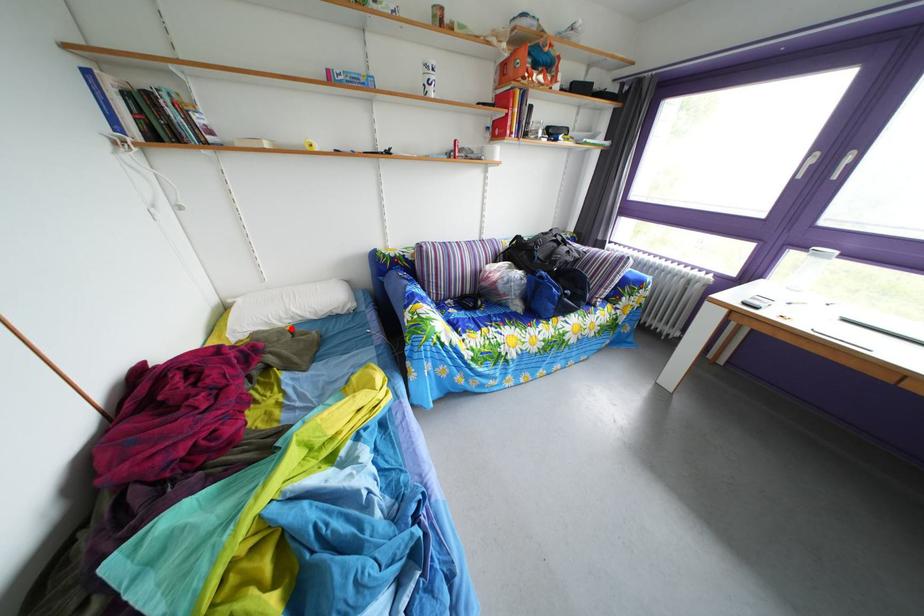
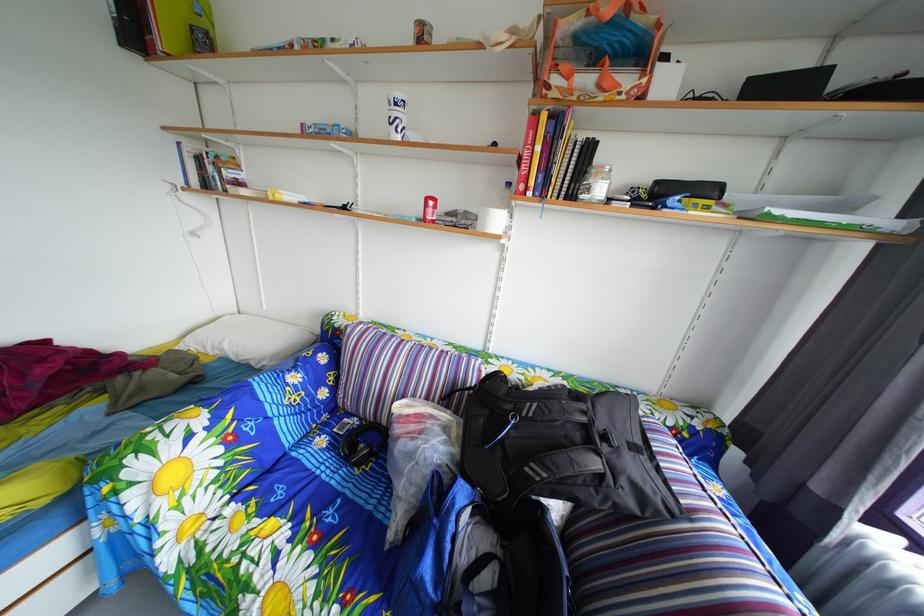
Where in the second image is the point corresponding to the highlighted location from the first image?

(224, 357)